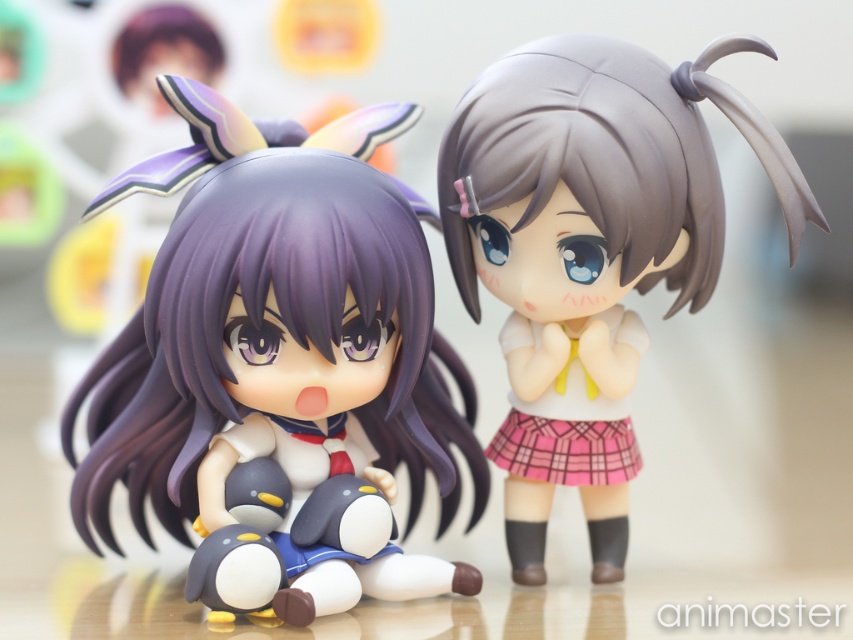
In the scene shown: Does satin purple doll at center have a smaller size compared to satin gray doll at center?

Incorrect, satin purple doll at center is not smaller in size than satin gray doll at center.

Is point (419, 486) behind point (608, 134)?

Yes, point (419, 486) is farther from viewer.

Is point (103, 440) farther from camera compared to point (654, 90)?

Yes, it is behind point (654, 90).

The image size is (853, 640). Find the location of `satin purple doll at center`. satin purple doll at center is located at coordinates (277, 369).